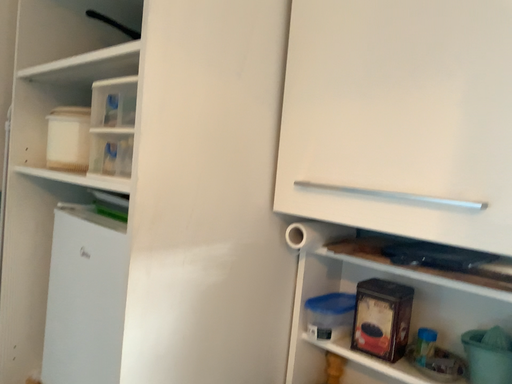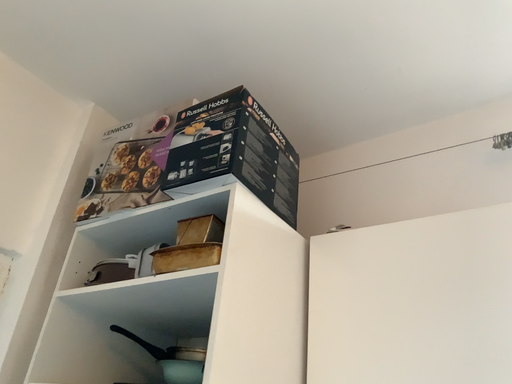
Question: Which way did the camera rotate in the video?

Choices:
 (A) rotated right
 (B) rotated left

Answer: (A)